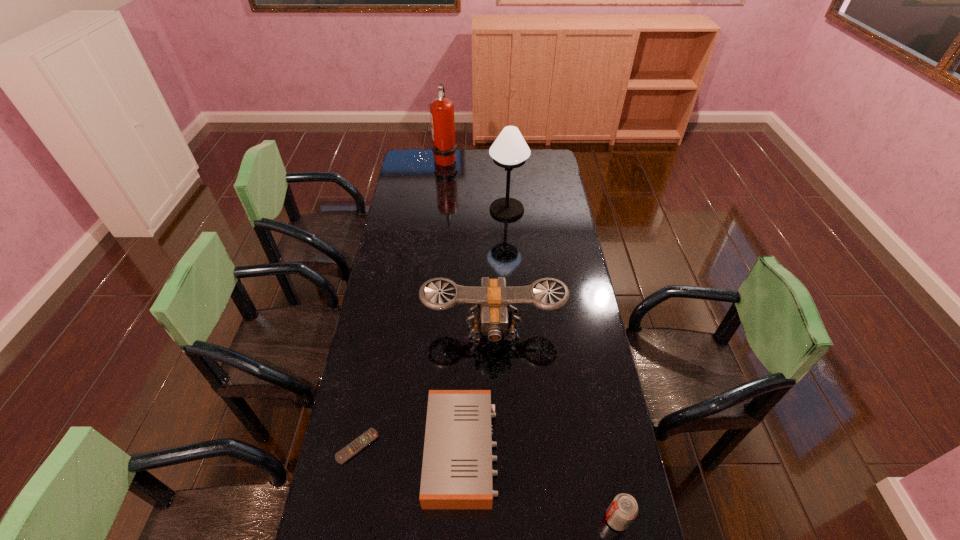
Where is `free region at the left edge of the desktop`? free region at the left edge of the desktop is located at coordinates (392, 324).

The width and height of the screenshot is (960, 540). I want to click on vacant space at the right edge of the desktop, so click(x=553, y=276).

You are a GUI agent. You are given a task and a screenshot of the screen. Output one action in this format:
    pyautogui.click(x=<x>, y=<y>)
    Task: Click on the free spot at the far right corner of the desktop
    
    Given the screenshot: What is the action you would take?
    pyautogui.click(x=542, y=153)

What are the coordinates of `free space between the radio receiver and the shortest object` in the screenshot? It's located at (410, 449).

The width and height of the screenshot is (960, 540). What are the coordinates of `empty space between the shortest object and the farthest object` in the screenshot? It's located at (401, 303).

Image resolution: width=960 pixels, height=540 pixels. I want to click on vacant area that lies between the rightmost object and the second farthest object, so (562, 364).

This screenshot has width=960, height=540. Find the location of `free space between the farthest object and the third shortest object`. free space between the farthest object and the third shortest object is located at coordinates (531, 339).

What are the coordinates of `empty space that is in between the soda can and the second shortest object` in the screenshot? It's located at (540, 485).

The height and width of the screenshot is (540, 960). Find the location of `free space between the fire extinguisher and the fourth tallest object`. free space between the fire extinguisher and the fourth tallest object is located at coordinates (531, 339).

Select which object is the third closest to the fire extinguisher. Please provide its 2D coordinates. Your answer should be formatted as a tuple, i.e. [(x, y)], where the tuple contains the x and y coordinates of a point satisfying the conditions above.

[(457, 472)]